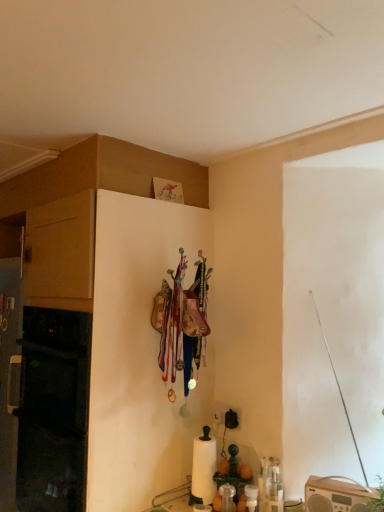
Question: Is point (1, 188) closer or farther from the camera than point (372, 504)?

Choices:
 (A) closer
 (B) farther

Answer: (B)

Question: From a real-world perspective, is matte wood cabinet at left above or below green leafy plant at lower right?

Choices:
 (A) above
 (B) below

Answer: (A)

Question: Is matte wood cabinet at left wider or thinner than green leafy plant at lower right?

Choices:
 (A) thin
 (B) wide

Answer: (B)

Question: Is green leafy plant at lower right taller or shorter than matte wood cabinet at left?

Choices:
 (A) tall
 (B) short

Answer: (B)

Question: Is green leafy plant at lower right bigger or smaller than matte wood cabinet at left?

Choices:
 (A) big
 (B) small

Answer: (B)

Question: Looking at their shapes, would you say green leafy plant at lower right is wider or thinner than matte wood cabinet at left?

Choices:
 (A) thin
 (B) wide

Answer: (A)

Question: Which is correct: green leafy plant at lower right is inside matte wood cabinet at left, or outside of it?

Choices:
 (A) outside
 (B) inside

Answer: (A)